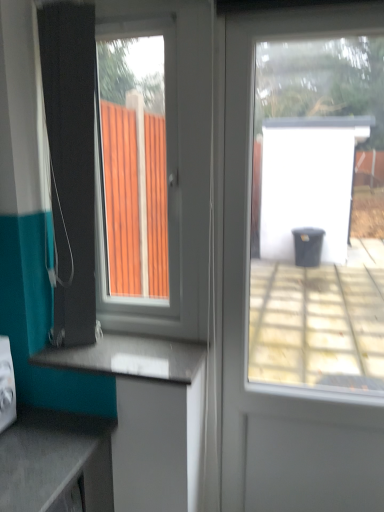
Question: Can you confirm if smooth gray countertop at lower center is wider than teal fabric shower curtain at left?

Choices:
 (A) yes
 (B) no

Answer: (A)

Question: Can you confirm if smooth gray countertop at lower center is bigger than teal fabric shower curtain at left?

Choices:
 (A) no
 (B) yes

Answer: (A)

Question: Is teal fabric shower curtain at left completely or partially inside smooth gray countertop at lower center?

Choices:
 (A) yes
 (B) no

Answer: (B)

Question: Is smooth gray countertop at lower center facing towards teal fabric shower curtain at left?

Choices:
 (A) no
 (B) yes

Answer: (A)

Question: Can you confirm if smooth gray countertop at lower center is smaller than teal fabric shower curtain at left?

Choices:
 (A) no
 (B) yes

Answer: (B)

Question: Considering the relative positions of transparent glass door at center and teal fabric shower curtain at left in the image provided, is transparent glass door at center to the left or to the right of teal fabric shower curtain at left?

Choices:
 (A) right
 (B) left

Answer: (A)

Question: From a real-world perspective, is transparent glass door at center above or below teal fabric shower curtain at left?

Choices:
 (A) below
 (B) above

Answer: (A)

Question: In the image, is transparent glass door at center positioned in front of or behind teal fabric shower curtain at left?

Choices:
 (A) behind
 (B) front

Answer: (B)

Question: Choose the correct answer: Is transparent glass door at center inside teal fabric shower curtain at left or outside it?

Choices:
 (A) inside
 (B) outside

Answer: (B)

Question: In terms of size, does teal fabric shower curtain at left appear bigger or smaller than smooth gray countertop at lower center?

Choices:
 (A) big
 (B) small

Answer: (A)

Question: Looking at their shapes, would you say teal fabric shower curtain at left is wider or thinner than smooth gray countertop at lower center?

Choices:
 (A) wide
 (B) thin

Answer: (B)

Question: From their relative heights in the image, would you say teal fabric shower curtain at left is taller or shorter than smooth gray countertop at lower center?

Choices:
 (A) short
 (B) tall

Answer: (B)

Question: Considering their positions, is teal fabric shower curtain at left located in front of or behind smooth gray countertop at lower center?

Choices:
 (A) behind
 (B) front

Answer: (B)

Question: Considering the relative positions of transparent glass door at center and smooth gray countertop at lower center in the image provided, is transparent glass door at center to the left or to the right of smooth gray countertop at lower center?

Choices:
 (A) right
 (B) left

Answer: (A)

Question: Looking at the image, does transparent glass door at center seem bigger or smaller compared to smooth gray countertop at lower center?

Choices:
 (A) small
 (B) big

Answer: (B)